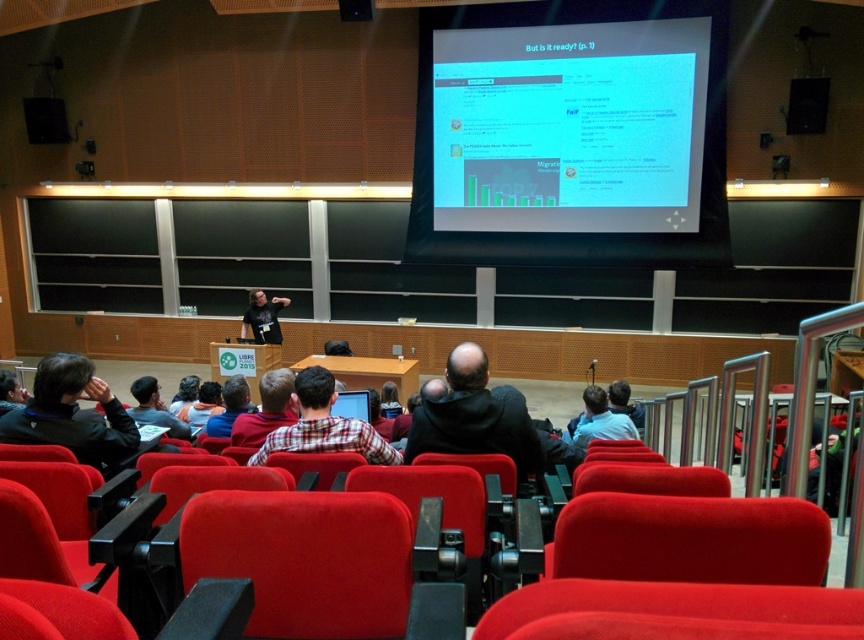
Does velvet red seat at lower center appear over dark blue hoodie at lower left?

Incorrect, velvet red seat at lower center is not positioned above dark blue hoodie at lower left.

Does velvet red seat at lower center appear under dark blue hoodie at lower left?

Yes, velvet red seat at lower center is below dark blue hoodie at lower left.

Who is more forward, (360, 540) or (86, 365)?

Point (360, 540)

What are the coordinates of `velvet red seat at lower center` in the screenshot? It's located at click(x=305, y=557).

Is velvet red chair at center above matte red chair at lower center?

No.

The width and height of the screenshot is (864, 640). Describe the element at coordinates (689, 540) in the screenshot. I see `velvet red chair at center` at that location.

This screenshot has width=864, height=640. I want to click on velvet red chair at center, so click(689, 540).

Measure the distance between white glossy projector screen at upper center and camera.

white glossy projector screen at upper center and camera are 7.96 meters apart from each other.

I want to click on white glossy projector screen at upper center, so click(x=570, y=132).